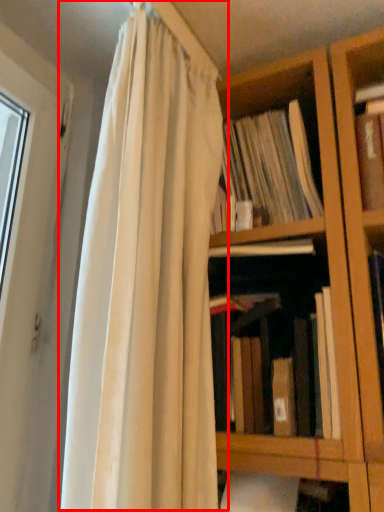
Question: Considering the relative positions of curtain (annotated by the red box) and book in the image provided, where is curtain (annotated by the red box) located with respect to the staircase?

Choices:
 (A) right
 (B) left

Answer: (B)